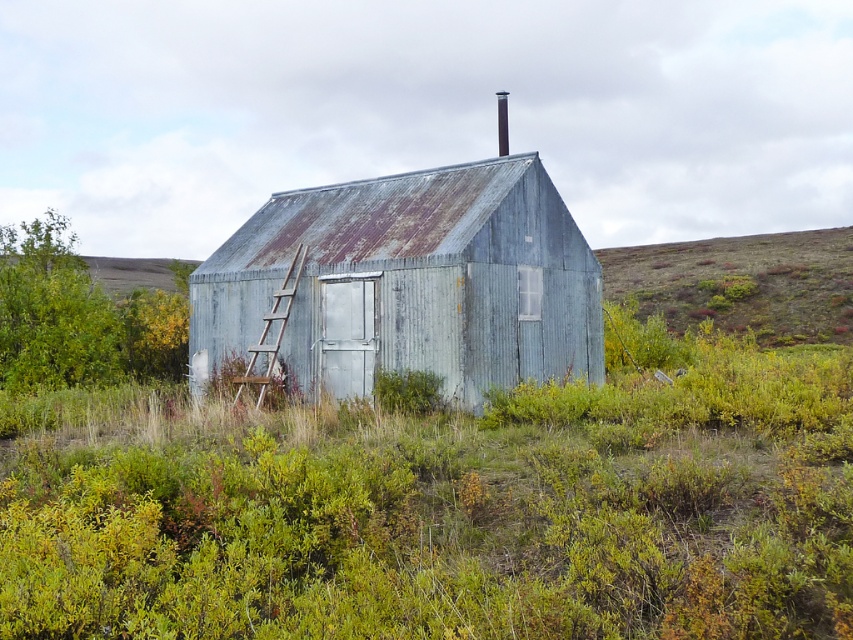
Question: Which point is farther to the camera?

Choices:
 (A) wooden ladder at center
 (B) rusty corrugated metal hut at center

Answer: (A)

Question: Is rusty corrugated metal hut at center behind wooden ladder at center?

Choices:
 (A) yes
 (B) no

Answer: (B)

Question: Which point is farther to the camera?

Choices:
 (A) (270, 371)
 (B) (268, 356)

Answer: (B)

Question: In this image, where is rusty corrugated metal hut at center located relative to wooden ladder at center?

Choices:
 (A) below
 (B) above

Answer: (B)

Question: Can you confirm if rusty corrugated metal hut at center is wider than wooden ladder at center?

Choices:
 (A) yes
 (B) no

Answer: (A)